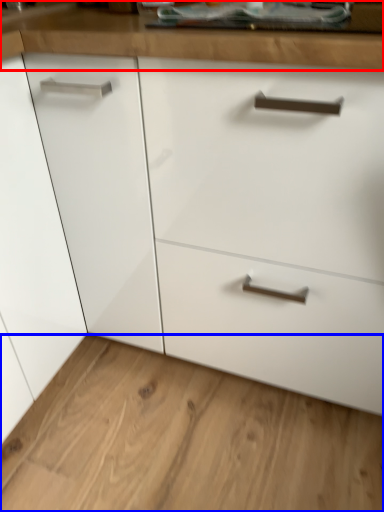
Question: Which point is further to the camera, counter top (highlighted by a red box) or plain (highlighted by a blue box)?

Choices:
 (A) counter top
 (B) plain

Answer: (B)